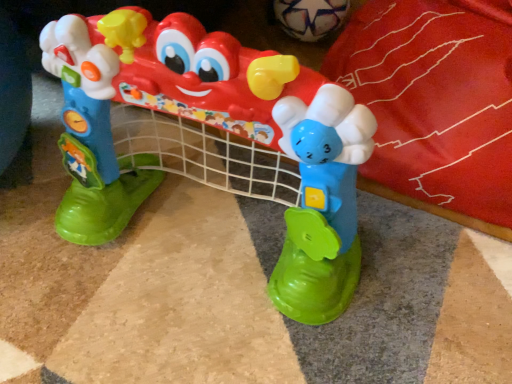
Question: Looking at their shapes, would you say white matte soccer ball at upper center, the 2th toy in the front-to-back sequence, is wider or thinner than plastic toy at center, which ranks as the second toy in top-to-bottom order?

Choices:
 (A) wide
 (B) thin

Answer: (B)

Question: Is white matte soccer ball at upper center, the 2th toy positioned from the bottom, situated inside plastic toy at center, which is the first toy in bottom-to-top order, or outside?

Choices:
 (A) inside
 (B) outside

Answer: (B)

Question: In terms of size, does white matte soccer ball at upper center, the 2th toy in the front-to-back sequence, appear bigger or smaller than plastic toy at center, which is the first toy in bottom-to-top order?

Choices:
 (A) big
 (B) small

Answer: (B)

Question: Does point (336, 244) appear closer or farther from the camera than point (334, 29)?

Choices:
 (A) farther
 (B) closer

Answer: (B)

Question: From a real-world perspective, is plastic toy at center, the first toy in the front-to-back sequence, physically located above or below white matte soccer ball at upper center, the 2th toy positioned from the bottom?

Choices:
 (A) below
 (B) above

Answer: (B)

Question: Considering the positions of plastic toy at center, which is the 2th toy in back-to-front order, and white matte soccer ball at upper center, the 2th toy positioned from the bottom, in the image, is plastic toy at center, which is the 2th toy in back-to-front order, taller or shorter than white matte soccer ball at upper center, the 2th toy positioned from the bottom,?

Choices:
 (A) short
 (B) tall

Answer: (B)

Question: Looking at their shapes, would you say plastic toy at center, which is the 2th toy in back-to-front order, is wider or thinner than white matte soccer ball at upper center, the first toy in the top-to-bottom sequence?

Choices:
 (A) wide
 (B) thin

Answer: (A)